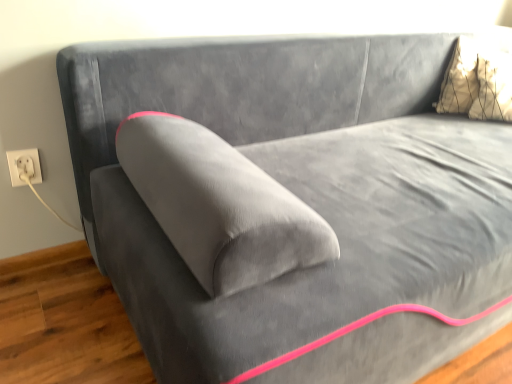
Question: Is metallic gold pillow at upper right facing towards white plastic socket at lower left?

Choices:
 (A) no
 (B) yes

Answer: (A)

Question: Does metallic gold pillow at upper right have a greater height compared to white plastic socket at lower left?

Choices:
 (A) yes
 (B) no

Answer: (A)

Question: Would you say metallic gold pillow at upper right is outside white plastic socket at lower left?

Choices:
 (A) no
 (B) yes

Answer: (B)

Question: From the image's perspective, is metallic gold pillow at upper right located above white plastic socket at lower left?

Choices:
 (A) yes
 (B) no

Answer: (A)

Question: Is metallic gold pillow at upper right smaller than white plastic socket at lower left?

Choices:
 (A) yes
 (B) no

Answer: (B)

Question: Is white plastic socket at lower left at the back of metallic gold pillow at upper right?

Choices:
 (A) yes
 (B) no

Answer: (B)

Question: Is white cord at lower left aimed at white plastic socket at lower left?

Choices:
 (A) no
 (B) yes

Answer: (A)

Question: From the image's perspective, is white cord at lower left on top of white plastic socket at lower left?

Choices:
 (A) no
 (B) yes

Answer: (A)

Question: Does white cord at lower left appear on the right side of white plastic socket at lower left?

Choices:
 (A) yes
 (B) no

Answer: (A)

Question: Is white cord at lower left positioned before white plastic socket at lower left?

Choices:
 (A) no
 (B) yes

Answer: (B)

Question: Is white cord at lower left touching white plastic socket at lower left?

Choices:
 (A) no
 (B) yes

Answer: (B)

Question: Can you confirm if white cord at lower left is taller than white plastic socket at lower left?

Choices:
 (A) yes
 (B) no

Answer: (A)

Question: From a real-world perspective, is white cord at lower left located higher than metallic gold pillow at upper right?

Choices:
 (A) no
 (B) yes

Answer: (A)